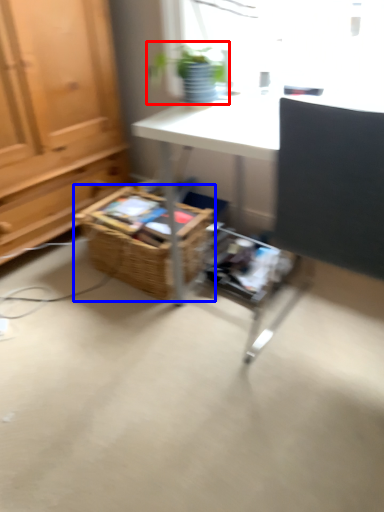
Question: Which object is further to the camera taking this photo, houseplant (highlighted by a red box) or basket (highlighted by a blue box)?

Choices:
 (A) houseplant
 (B) basket

Answer: (B)